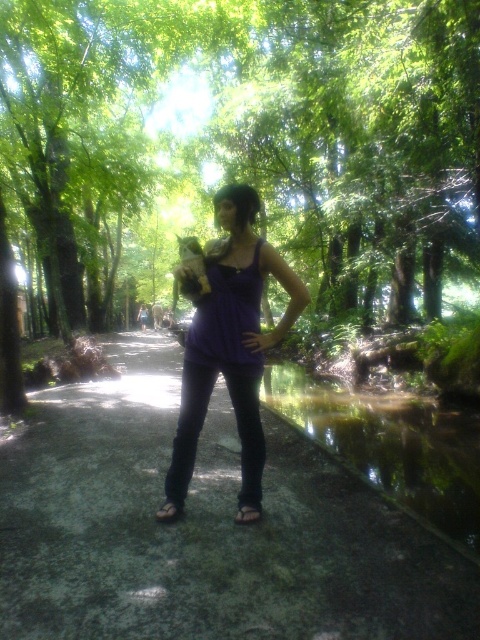
You are a photographer trying to capture the woman in the scene. If you want to focus on the purple matte tank top at center and the black leather sandal at lower center, which one should you adjust your camera focus on first to ensure it is sharp?

The purple matte tank top at center should be focused on first because it is closer to the viewer than the black leather sandal at lower center, so adjusting focus starting from the closer object ensures both are in focus.

You are a photographer trying to capture the woman in the forest scene. To ensure the purple matte tank top at center is in focus, where should you aim the camera? Specify the coordinates provided in the description.

The purple matte tank top at center is located at coordinates point (230, 340), so aim the camera at that point to ensure it is in focus.